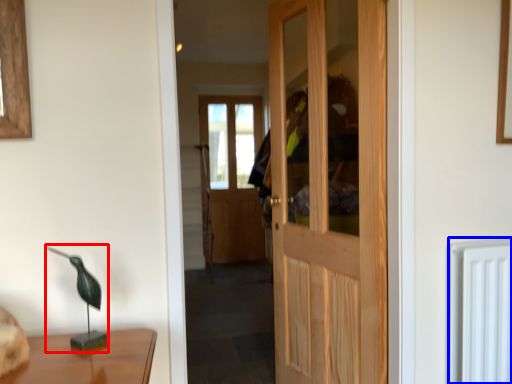
Question: Which object is further to the camera taking this photo, table lamp (highlighted by a red box) or radiator (highlighted by a blue box)?

Choices:
 (A) table lamp
 (B) radiator

Answer: (B)